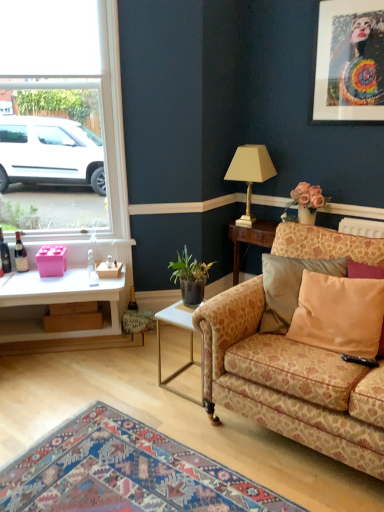
Find the location of a particular element. The image size is (384, 512). free space that is in between matte glass bottle at left, the second bottle from the left, and pink matte plastic box at left, which is the first box in top-to-bottom order is located at coordinates (28, 274).